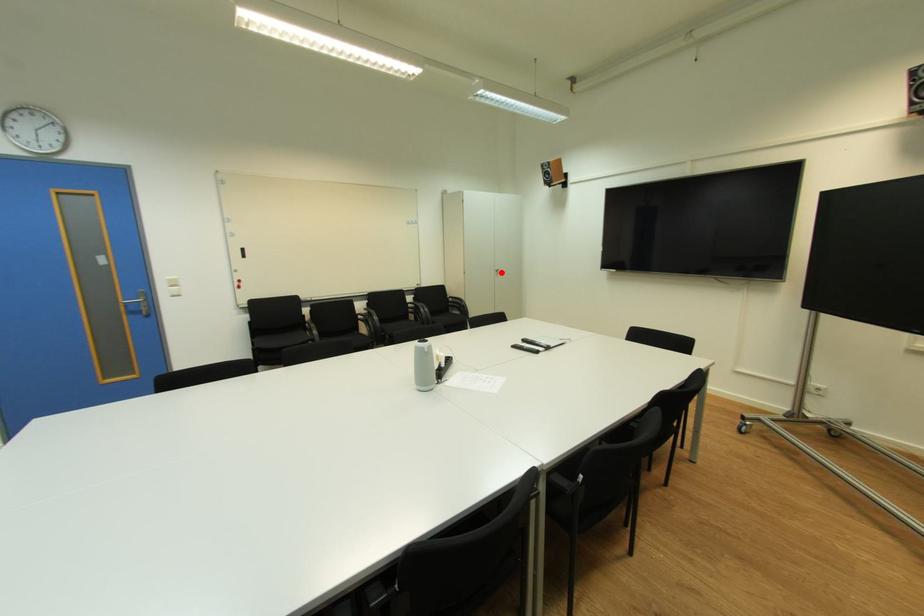
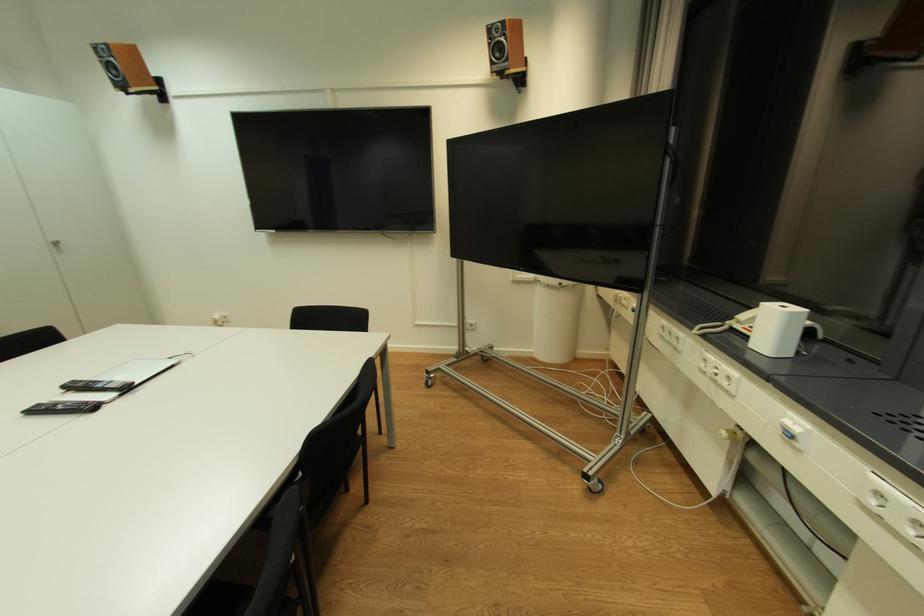
Locate, in the second image, the point that corresponds to the highlighted location in the first image.

(57, 246)